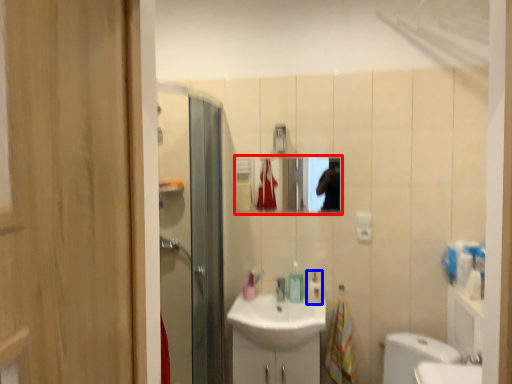
Question: Which object is further to the camera taking this photo, mirror (highlighted by a red box) or soap dispenser (highlighted by a blue box)?

Choices:
 (A) mirror
 (B) soap dispenser

Answer: (A)